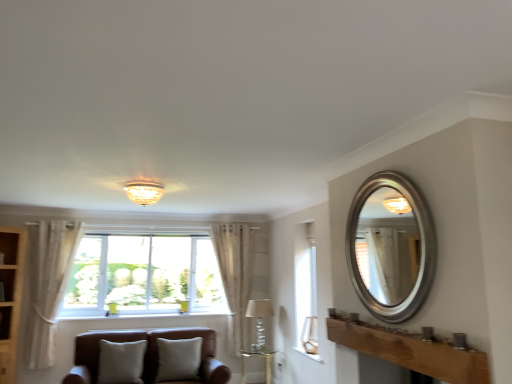
How much space does beige fabric pillow at lower left, marked as the 2th pillow in a right-to-left arrangement, occupy horizontally?

11.60 inches.

Identify the location of white textured stone at lower center. The height and width of the screenshot is (384, 512). (309, 354).

The height and width of the screenshot is (384, 512). I want to click on beige fabric pillow at center, the first pillow when ordered from right to left, so 178,360.

Find the location of a particular element. This screenshot has height=384, width=512. matte glass lampshade at upper center, positioned as the 1th lamp in left-to-right order is located at coordinates (144, 191).

The height and width of the screenshot is (384, 512). Describe the element at coordinates (259, 321) in the screenshot. I see `translucent glass lampshade at center, the 3th lamp when ordered from top to bottom` at that location.

I want to click on brown leather couch at lower left, so click(x=147, y=357).

Measure the distance between brown leather couch at lower left and camera.

4.21 meters.

Find the location of a particular element. Image resolution: width=512 pixels, height=384 pixels. beige fabric pillow at lower left, marked as the 2th pillow in a right-to-left arrangement is located at coordinates (121, 362).

Is clear glass table at lower center with beige fabric pillow at center, the first pillow when ordered from right to left?

No, clear glass table at lower center is not in contact with beige fabric pillow at center, the first pillow when ordered from right to left.

From a real-world perspective, is clear glass table at lower center positioned over beige fabric pillow at center, the second pillow from the left, based on gravity?

No, from a real-world perspective, clear glass table at lower center is not over beige fabric pillow at center, the second pillow from the left

Does clear glass table at lower center have a lesser height compared to beige fabric pillow at center, the first pillow when ordered from right to left?

Indeed, clear glass table at lower center has a lesser height compared to beige fabric pillow at center, the first pillow when ordered from right to left.

You are a GUI agent. You are given a task and a screenshot of the screen. Output one action in this format:
    pyautogui.click(x=<x>, y=<y>)
    Task: Click on the table below the beige fabric pillow at center, the first pillow when ordered from right to left (from a real-world perspective)
    This screenshot has width=512, height=384.
    Given the screenshot: What is the action you would take?
    pyautogui.click(x=257, y=356)

Is the depth of white textured stone at lower center greater than that of beige fabric pillow at lower left, marked as the 2th pillow in a right-to-left arrangement?

Yes, the depth of white textured stone at lower center is greater than that of beige fabric pillow at lower left, marked as the 2th pillow in a right-to-left arrangement.

Between white textured stone at lower center and beige fabric pillow at lower left, marked as the 2th pillow in a right-to-left arrangement, which one appears on the left side from the viewer's perspective?

beige fabric pillow at lower left, marked as the 2th pillow in a right-to-left arrangement, is more to the left.

How different are the orientations of white textured stone at lower center and beige fabric pillow at lower left, the 1th pillow when ordered from left to right, in degrees?

There is a 89.8-degree angle between the facing directions of white textured stone at lower center and beige fabric pillow at lower left, the 1th pillow when ordered from left to right.

From a real-world perspective, is white textured stone at lower center beneath beige fabric pillow at lower left, the 1th pillow when ordered from left to right?

No, from a real-world perspective, white textured stone at lower center is not below beige fabric pillow at lower left, the 1th pillow when ordered from left to right.

Can you tell me how much wooden cabinet at left and brown leather couch at lower left differ in facing direction?

41.5 degrees.

From the image's perspective, does wooden cabinet at left appear higher than brown leather couch at lower left?

Yes, from the image's perspective, wooden cabinet at left is above brown leather couch at lower left.

Which is more to the right, wooden cabinet at left or brown leather couch at lower left?

brown leather couch at lower left.

Measure the distance between wooden cabinet at left and brown leather couch at lower left.

wooden cabinet at left and brown leather couch at lower left are 1.50 meters apart from each other.

Is white sheer curtain at left, which appears as the 2th curtain when viewed from the right, at the back of beige fabric pillow at lower left, marked as the 2th pillow in a right-to-left arrangement?

No, white sheer curtain at left, which appears as the 2th curtain when viewed from the right, is not at the back of beige fabric pillow at lower left, marked as the 2th pillow in a right-to-left arrangement.

Measure the distance from beige fabric pillow at lower left, marked as the 2th pillow in a right-to-left arrangement, to white sheer curtain at left, which appears as the 1th curtain when viewed from the front.

beige fabric pillow at lower left, marked as the 2th pillow in a right-to-left arrangement, and white sheer curtain at left, which appears as the 1th curtain when viewed from the front, are 3.86 feet apart.

From the image's perspective, between beige fabric pillow at lower left, marked as the 2th pillow in a right-to-left arrangement, and white sheer curtain at left, arranged as the first curtain when viewed from the left, which one is located above?

From the image's view, white sheer curtain at left, arranged as the first curtain when viewed from the left, is above.

Does beige fabric pillow at lower left, marked as the 2th pillow in a right-to-left arrangement, come in front of white sheer curtain at left, the 2th curtain in the back-to-front sequence?

Yes, beige fabric pillow at lower left, marked as the 2th pillow in a right-to-left arrangement, is closer to the viewer.

Identify the location of window located behind the clear glass table at lower center. (144, 276).

From a real-world perspective, is white glass window at center positioned above or below clear glass table at lower center?

From a real-world perspective, white glass window at center is physically above clear glass table at lower center.

Is white glass window at center not close to clear glass table at lower center?

Yes, white glass window at center and clear glass table at lower center are quite far apart.

How different are the orientations of white glass window at center and clear glass table at lower center in degrees?

The facing directions of white glass window at center and clear glass table at lower center are 90 degrees apart.

Identify the location of window that appears above the brown leather couch at lower left (from a real-world perspective). (144, 276).

From the image's perspective, would you say white glass window at center is shown under brown leather couch at lower left?

No.

Is white glass window at center bigger or smaller than brown leather couch at lower left?

Clearly, white glass window at center is smaller in size than brown leather couch at lower left.

Considering the sizes of objects white glass window at center and brown leather couch at lower left in the image provided, who is taller, white glass window at center or brown leather couch at lower left?

white glass window at center.

Which object is more forward, white sheer curtain at left, the 2th curtain in the back-to-front sequence, or gold glass vase at lower right, acting as the second lamp starting from the bottom?

gold glass vase at lower right, acting as the second lamp starting from the bottom.

Can you tell me how much white sheer curtain at left, which appears as the 1th curtain when viewed from the front, and gold glass vase at lower right, marked as the first lamp in a right-to-left arrangement, differ in facing direction?

There is a 90-degree angle between the facing directions of white sheer curtain at left, which appears as the 1th curtain when viewed from the front, and gold glass vase at lower right, marked as the first lamp in a right-to-left arrangement.

Is white sheer curtain at left, arranged as the first curtain when viewed from the left, smaller than gold glass vase at lower right, marked as the first lamp in a right-to-left arrangement?

Actually, white sheer curtain at left, arranged as the first curtain when viewed from the left, might be larger than gold glass vase at lower right, marked as the first lamp in a right-to-left arrangement.

Would you consider white sheer curtain at left, the 2th curtain in the back-to-front sequence, to be distant from gold glass vase at lower right, marked as the first lamp in a right-to-left arrangement?

Yes.

Locate an element on the screen. The height and width of the screenshot is (384, 512). table that is on the right side of beige fabric pillow at center, the first pillow when ordered from right to left is located at coordinates (257, 356).

From a real-world perspective, count 2nd pillows downward from the white textured stone at lower center and point to it. Please provide its 2D coordinates.

[(121, 362)]

Based on their spatial positions, is clear glass table at lower center or brown wooden mantle at lower right further from matte glass lampshade at upper center, acting as the 3th lamp starting from the bottom?

Based on the image, clear glass table at lower center appears to be further to matte glass lampshade at upper center, acting as the 3th lamp starting from the bottom.

Based on their spatial positions, is beige fabric pillow at center, the second pillow from the left, or matte glass lampshade at upper center, the 1th lamp when ordered from front to back, closer to translucent glass lampshade at center, the 3th lamp when ordered from top to bottom?

beige fabric pillow at center, the second pillow from the left.

Estimate the real-world distances between objects in this image. Which object is further from white sheer curtain at left, which appears as the 1th curtain when viewed from the front, brown leather couch at lower left or white textured stone at lower center?

white textured stone at lower center is further to white sheer curtain at left, which appears as the 1th curtain when viewed from the front.

Considering their positions, is matte glass lampshade at upper center, positioned as the 1th lamp in top-to-bottom order, positioned further to brown wooden mantle at lower right than white glass window at center?

The object further to brown wooden mantle at lower right is white glass window at center.

Estimate the real-world distances between objects in this image. Which object is closer to beige fabric pillow at lower left, marked as the 2th pillow in a right-to-left arrangement, translucent glass lampshade at center, arranged as the third lamp when viewed from the front, or white glass window at center?

white glass window at center lies closer to beige fabric pillow at lower left, marked as the 2th pillow in a right-to-left arrangement, than the other object.

From the image, which object appears to be farther from sheer fabric curtain at center, which appears as the first curtain when viewed from the back, gold glass vase at lower right, which is the 3th lamp in left-to-right order, or beige fabric pillow at center, the first pillow when ordered from right to left?

gold glass vase at lower right, which is the 3th lamp in left-to-right order.

From the image, which object appears to be farther from white textured stone at lower center, white glass window at center or brown leather couch at lower left?

The object further to white textured stone at lower center is white glass window at center.

Based on their spatial positions, is matte glass lampshade at upper center, the 1th lamp when ordered from front to back, or white sheer curtain at left, arranged as the first curtain when viewed from the left, closer to gold glass vase at lower right, marked as the first lamp in a right-to-left arrangement?

Based on the image, matte glass lampshade at upper center, the 1th lamp when ordered from front to back, appears to be nearer to gold glass vase at lower right, marked as the first lamp in a right-to-left arrangement.

You are a GUI agent. You are given a task and a screenshot of the screen. Output one action in this format:
    pyautogui.click(x=<x>, y=<y>)
    Task: Click on the table between brown wooden mantle at lower right and white glass window at center in the front-back direction
    The image size is (512, 384).
    Given the screenshot: What is the action you would take?
    pyautogui.click(x=257, y=356)

What are the coordinates of `window situated between wooden cabinet at left and gold glass vase at lower right, the 2th lamp viewed from the top, from left to right` in the screenshot? It's located at (144, 276).

I want to click on table between brown leather couch at lower left and sheer fabric curtain at center, which appears as the first curtain when viewed from the back, in the front-back direction, so click(257, 356).

Image resolution: width=512 pixels, height=384 pixels. Identify the location of pillow between wooden cabinet at left and brown leather couch at lower left from left to right. (121, 362).